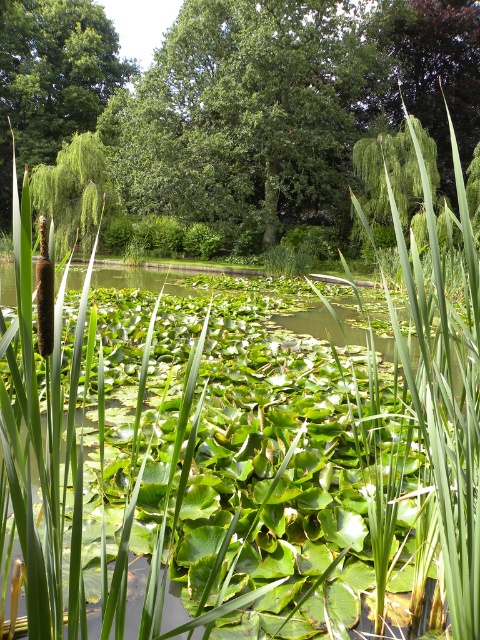
Consider the image. You are standing at the edge of the pond and want to know how far the point at coordinates point (x=262, y=28) is from you. Can you determine the distance?

The point (x=262, y=28) is 112.45 feet from the camera, so the distance from you to the point is 112.45 feet.

Looking at this image, you are a bird looking for a nesting spot. You see two trees in the scene, the green leafy tree at center and the green leafy tree at left. Which tree has a wider canopy to provide more shelter?

The green leafy tree at center has a wider canopy than the green leafy tree at left, so it provides more shelter.

You are a bird looking for a nesting spot. You see two trees in the scene, the green leafy tree at center and the green leafy tree at left. Which tree would provide more space for your nest?

The green leafy tree at center has a larger size compared to the green leafy tree at left, so it would provide more space for your nest.